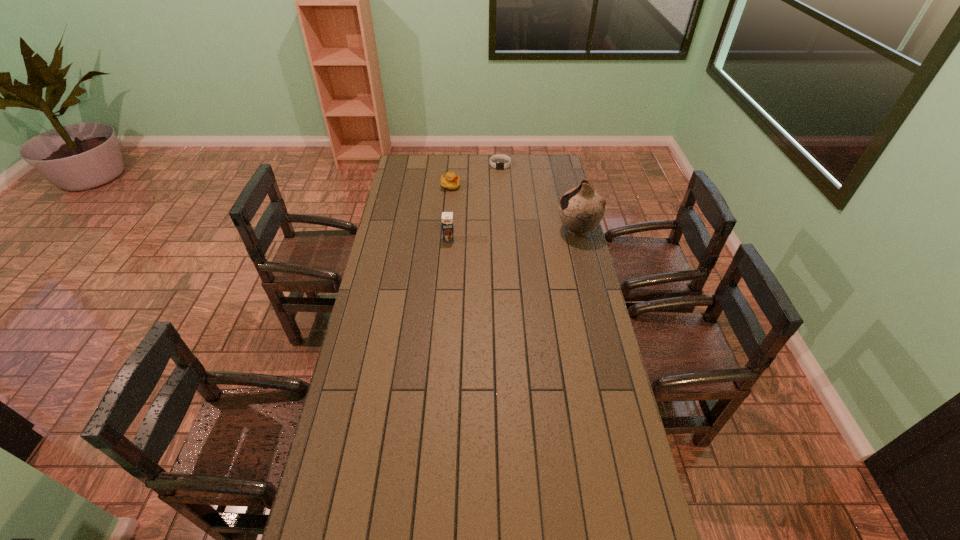
Locate an element on the screen. vacant spot on the desktop that is between the chocolate milk and the pottery and is positioned on the outer surface of the wristband is located at coordinates (498, 235).

I want to click on free space on the desktop that is between the chocolate milk and the rightmost object and is positioned at the beak of the second shortest object, so click(524, 234).